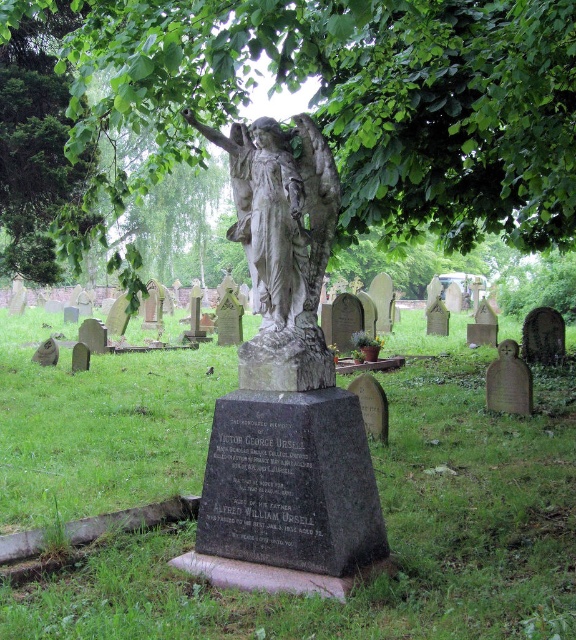
You are standing at the point marked as point (x=240, y=45) in the cemetery scene. A tour guide asks you to move 10 feet towards the statue of the angel. Will you be able to reach the statue after moving?

The distance between point (x=240, y=45) and the viewer is 11.28 feet. Moving 10 feet towards the statue would leave you 1.28 feet away from it, so yes, you can reach the statue.

You are standing in the cemetery and see the white stone statue at center and the smooth gray stone at lower right. Which object is positioned to the left of the other?

The white stone statue at center is to the left of smooth gray stone at lower right.

You are standing in front of the cemetery statue and want to take a photo. There are two points marked on the statue, one at coordinates point [234,148] and another at point [502,360]. Which point is closer to your camera lens when taking the photo?

Point [234,148] is closer to the camera than point [502,360].